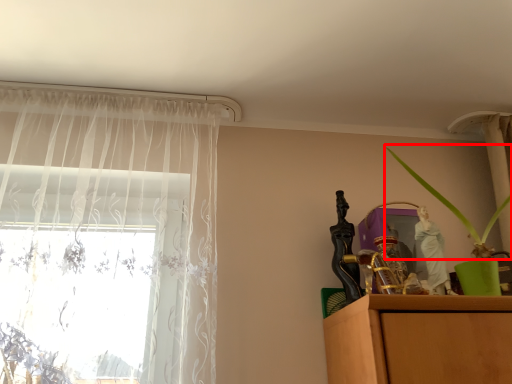
Question: From the image's perspective, what is the correct spatial positioning of plant (annotated by the red box) in reference to curtain?

Choices:
 (A) above
 (B) below

Answer: (A)